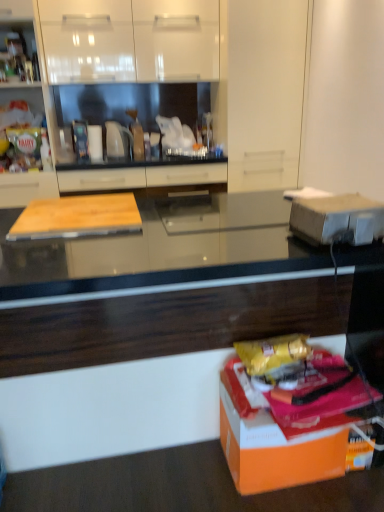
Question: Considering the relative positions of orange matte cardboard box at lower right, which is the 2th cardboard box from top to bottom, and wooden cutting board at left, which ranks as the 1th cabinetry in left-to-right order, in the image provided, is orange matte cardboard box at lower right, which is the 2th cardboard box from top to bottom, to the left or to the right of wooden cutting board at left, which ranks as the 1th cabinetry in left-to-right order,?

Choices:
 (A) right
 (B) left

Answer: (A)

Question: Considering the positions of orange matte cardboard box at lower right, positioned as the 1th cardboard box in bottom-to-top order, and wooden cutting board at left, which ranks as the 1th cabinetry in left-to-right order, in the image, is orange matte cardboard box at lower right, positioned as the 1th cardboard box in bottom-to-top order, taller or shorter than wooden cutting board at left, which ranks as the 1th cabinetry in left-to-right order,?

Choices:
 (A) tall
 (B) short

Answer: (B)

Question: Which object is positioned closest to the matte wood cutting board at center, the first cabinetry when ordered from right to left?

Choices:
 (A) white glossy cabinet at upper center, the 2th cabinetry from the left
 (B) white cardboard box at right, the second cardboard box in the bottom-to-top sequence
 (C) black glossy countertop at center
 (D) wooden cutting board at left, the 3th cabinetry when ordered from right to left
 (E) orange matte cardboard box at lower right, which is the 2th cardboard box from top to bottom

Answer: (A)

Question: Estimate the real-world distances between objects in this image. Which object is farther from the white glossy cabinet at upper center, the second cabinetry from the right?

Choices:
 (A) wooden cutting board at left, which ranks as the 1th cabinetry in left-to-right order
 (B) white cardboard box at right, the second cardboard box in the bottom-to-top sequence
 (C) black glossy countertop at center
 (D) orange matte cardboard box at lower right, positioned as the 1th cardboard box in bottom-to-top order
 (E) matte wood cutting board at center, the first cabinetry when ordered from right to left

Answer: (D)